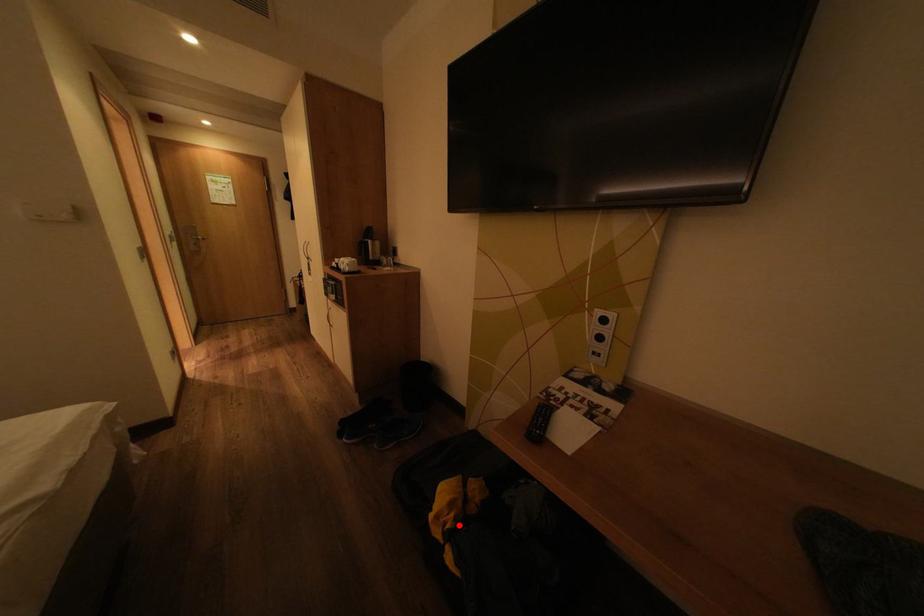
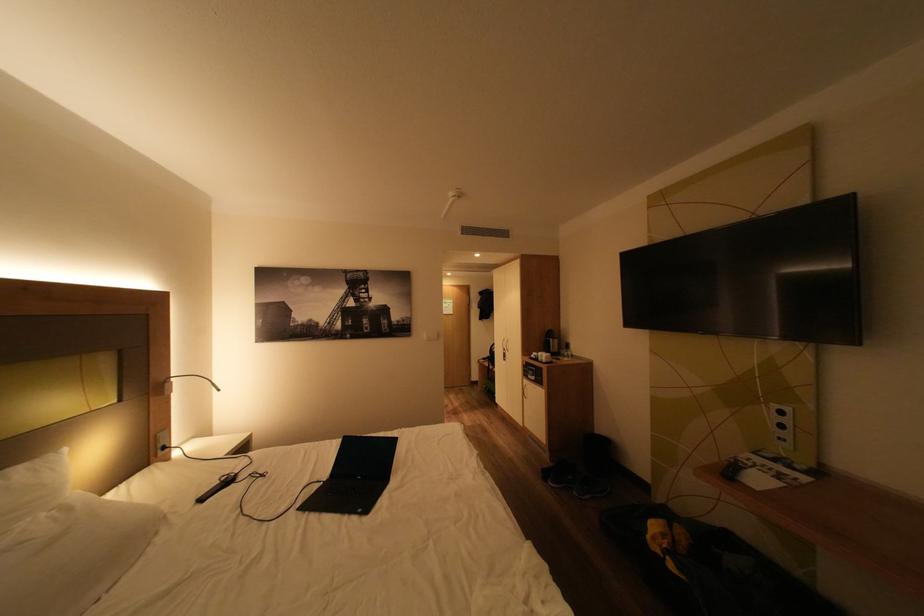
Question: I am providing you with two images of the same scene from different viewpoints. Given a red point in image1, look at the same physical point in image2. Is it:

Choices:
 (A) Closer to the viewpoint
 (B) Farther from the viewpoint

Answer: (A)